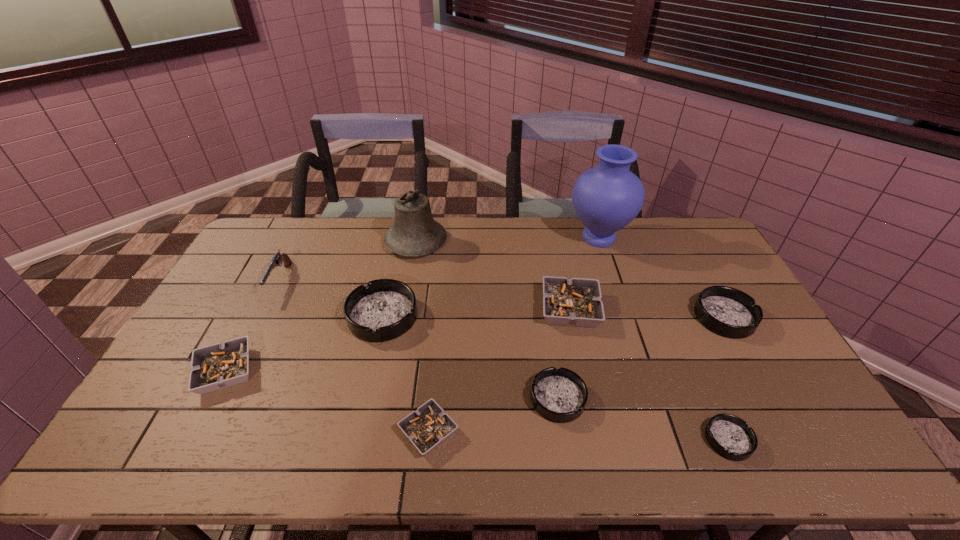
This screenshot has height=540, width=960. I want to click on vase, so click(x=606, y=198).

You are a GUI agent. You are given a task and a screenshot of the screen. Output one action in this format:
    pyautogui.click(x=<x>, y=<y>)
    Task: Click on the blue vase
    The width and height of the screenshot is (960, 540).
    Given the screenshot: What is the action you would take?
    pyautogui.click(x=606, y=198)

The height and width of the screenshot is (540, 960). What are the coordinates of `bell` in the screenshot? It's located at (415, 232).

Image resolution: width=960 pixels, height=540 pixels. In order to click on the eighth shortest object in this screenshot , I will do `click(278, 258)`.

This screenshot has height=540, width=960. Find the location of `the leftmost dark ashtray`. the leftmost dark ashtray is located at coordinates (385, 309).

Locate an element on the screen. This screenshot has height=540, width=960. the farthest gray ashtray is located at coordinates (576, 302).

What are the coordinates of `the biggest gray ashtray` in the screenshot? It's located at (576, 302).

Locate an element on the screen. the rightmost object is located at coordinates [726, 311].

What are the coordinates of `the rightmost dark ashtray` in the screenshot? It's located at (726, 311).

Locate an element on the screen. The height and width of the screenshot is (540, 960). the second biggest gray ashtray is located at coordinates (217, 366).